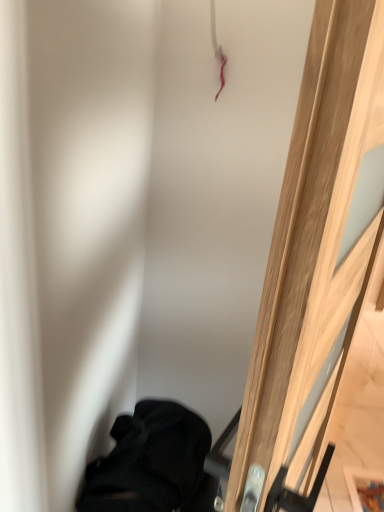
Question: From a real-world perspective, is black fabric at lower left positioned above or below wooden door at right?

Choices:
 (A) above
 (B) below

Answer: (B)

Question: From the image's perspective, relative to wooden door at right, is black fabric at lower left above or below?

Choices:
 (A) above
 (B) below

Answer: (B)

Question: Based on their sizes in the image, would you say black fabric at lower left is bigger or smaller than wooden door at right?

Choices:
 (A) small
 (B) big

Answer: (A)

Question: Based on their sizes in the image, would you say wooden door at right is bigger or smaller than black fabric at lower left?

Choices:
 (A) big
 (B) small

Answer: (A)

Question: In terms of width, does wooden door at right look wider or thinner when compared to black fabric at lower left?

Choices:
 (A) wide
 (B) thin

Answer: (B)

Question: From their relative heights in the image, would you say wooden door at right is taller or shorter than black fabric at lower left?

Choices:
 (A) tall
 (B) short

Answer: (A)

Question: Would you say wooden door at right is to the left or to the right of black fabric at lower left in the picture?

Choices:
 (A) right
 (B) left

Answer: (A)